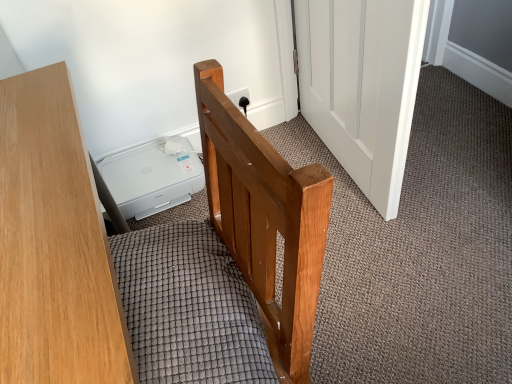
You are a GUI agent. You are given a task and a screenshot of the screen. Output one action in this format:
    pyautogui.click(x=<x>, y=<y>)
    Task: Click on the unoccupied region to the right of white wooden door at center
    The image size is (512, 384).
    Given the screenshot: What is the action you would take?
    pyautogui.click(x=453, y=144)